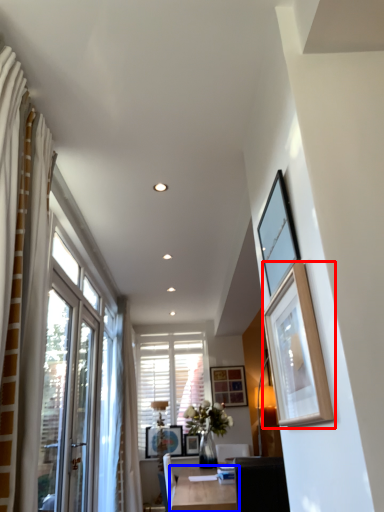
Question: Which of the following is the farthest to the observer, picture frame (highlighted by a red box) or table (highlighted by a blue box)?

Choices:
 (A) picture frame
 (B) table

Answer: (B)